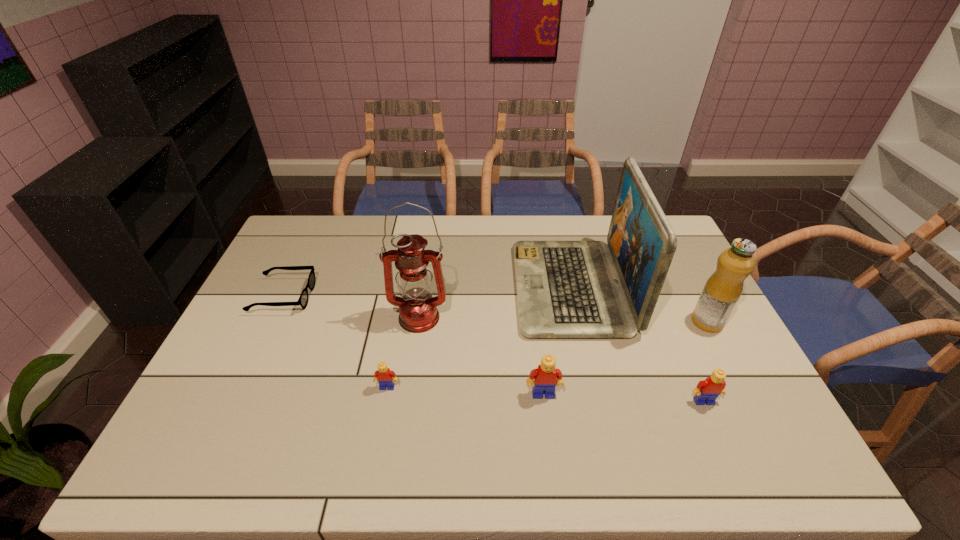
Identify the location of free location located on the front label of the third tallest object. (635, 322).

Locate an element on the screen. vacant space situated on the front label of the third tallest object is located at coordinates (614, 322).

Locate an element on the screen. object at the far edge is located at coordinates (565, 289).

Identify the location of object that is at the left edge. This screenshot has height=540, width=960. [x=303, y=299].

Identify the location of Lego present at the right edge. This screenshot has height=540, width=960. (707, 390).

Identify the location of fruit juice at the right edge. (724, 287).

At what (x,y) coordinates should I click in order to perform the action: click on object that is at the near right corner. Please return your answer as a coordinate pair (x, y). The width and height of the screenshot is (960, 540). Looking at the image, I should click on (707, 390).

Locate an element on the screen. The image size is (960, 540). vacant area at the far edge of the desktop is located at coordinates (475, 237).

This screenshot has width=960, height=540. What are the coordinates of `vacant space at the near edge of the desktop` in the screenshot? It's located at point(470,413).

In the image, there is a desktop. Find the location of `free region at the left edge`. free region at the left edge is located at coordinates (272, 259).